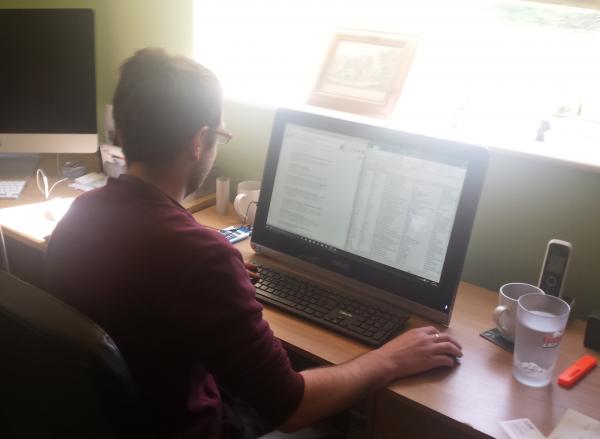
You are a GUI agent. You are given a task and a screenshot of the screen. Output one action in this format:
    pyautogui.click(x=<x>, y=<y>)
    Task: Click on the deactivated computer monitor
    Image resolution: width=600 pixels, height=439 pixels.
    Given the screenshot: What is the action you would take?
    pyautogui.click(x=40, y=69)